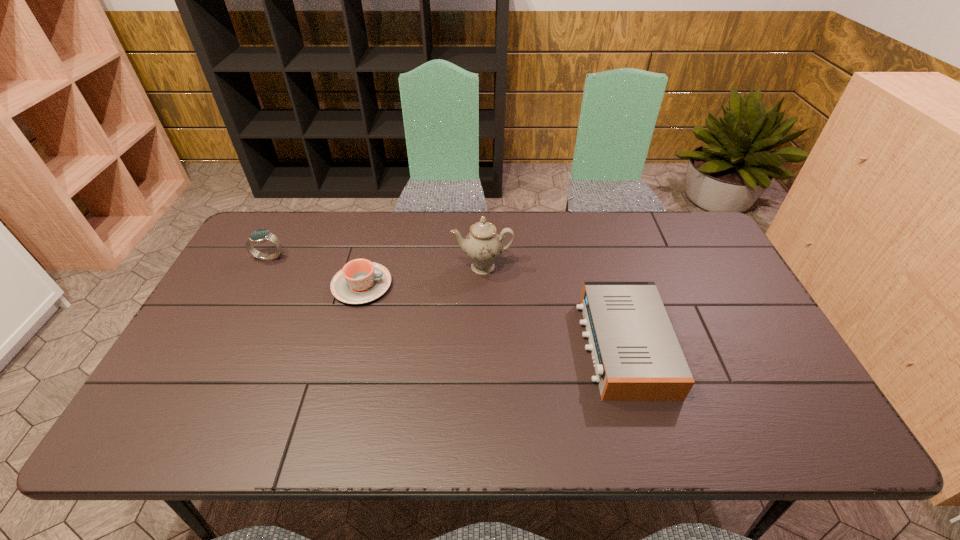
Image resolution: width=960 pixels, height=540 pixels. I want to click on free region at the right edge of the desktop, so click(711, 262).

In the image, there is a desktop. What are the coordinates of `free region at the far left corner` in the screenshot? It's located at coord(263,221).

Where is `free region at the far right corner of the desktop`? free region at the far right corner of the desktop is located at coordinates (678, 244).

Locate an element on the screen. This screenshot has height=540, width=960. vacant area between the second tallest object and the second object from left to right is located at coordinates (316, 272).

Locate an element on the screen. Image resolution: width=960 pixels, height=540 pixels. vacant space that's between the rightmost object and the second tallest object is located at coordinates (446, 302).

Image resolution: width=960 pixels, height=540 pixels. In order to click on unoccupied area between the right chinaware and the radio receiver in this screenshot , I will do `click(553, 307)`.

Where is `free space between the leftmost object and the radio receiver`? free space between the leftmost object and the radio receiver is located at coordinates (x=446, y=302).

The width and height of the screenshot is (960, 540). In order to click on free space between the right chinaware and the shortest object in this screenshot , I will do `click(422, 276)`.

Find the location of `free space between the tallest object and the rightmost object`. free space between the tallest object and the rightmost object is located at coordinates (553, 307).

Identify the location of vacant area that lies between the third shortest object and the rightmost object. This screenshot has width=960, height=540. (446, 302).